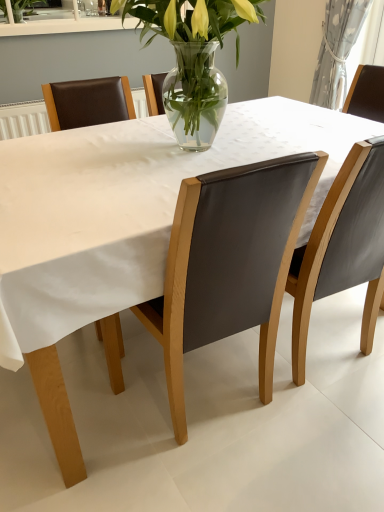
The width and height of the screenshot is (384, 512). What are the coordinates of `vacant area to the right of leather at center, the 2th chair viewed from the right` in the screenshot? It's located at (319, 439).